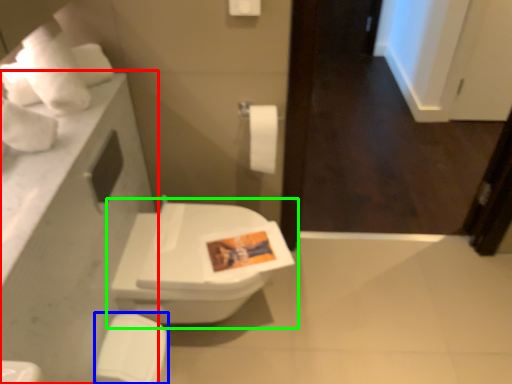
Question: Estimate the real-world distances between objects in this image. Which object is farther from counter top (highlighted by a red box), porcelain (highlighted by a blue box) or toilet (highlighted by a green box)?

Choices:
 (A) porcelain
 (B) toilet

Answer: (A)